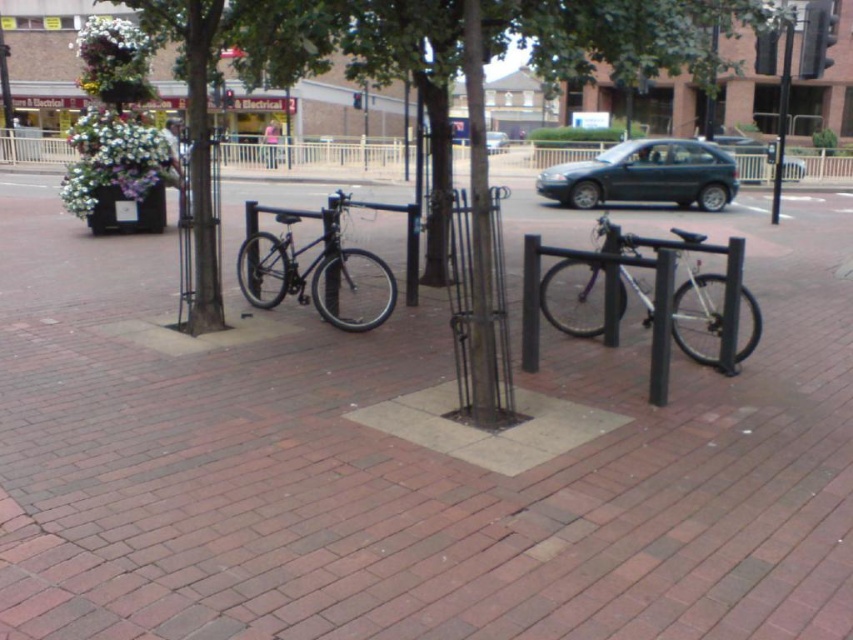
You are a delivery person who needs to move a 12 meter long ladder from the black metal pole at upper right to the bike rack at lower left. Can you carry it horizontally without tilting it? Please explain why or why not.

The distance between the black metal pole at upper right and the bike rack at lower left is 10.97 meters. Since the ladder is 12 meters long, it is longer than the available space between them. Therefore, you cannot carry it horizontally without tilting it.

Consider the image. You are a delivery person who needs to move a package from one side of the brick pavement at center to the other. The package is as wide as the shiny black bicycle at center. Can you carry it across without tilting it sideways?

The brick pavement at center is wider than the shiny black bicycle at center. Since the package is as wide as the bicycle, it should fit within the pavement width without needing to tilt it sideways.

You are standing at the center of the pedestrian area and want to locate the black metal pole at upper right. According to the coordinates provided, where should you look relative to your position?

The black metal pole at upper right is located at coordinates point (782, 112), which means it is positioned at the upper right corner of the scene relative to your central position.